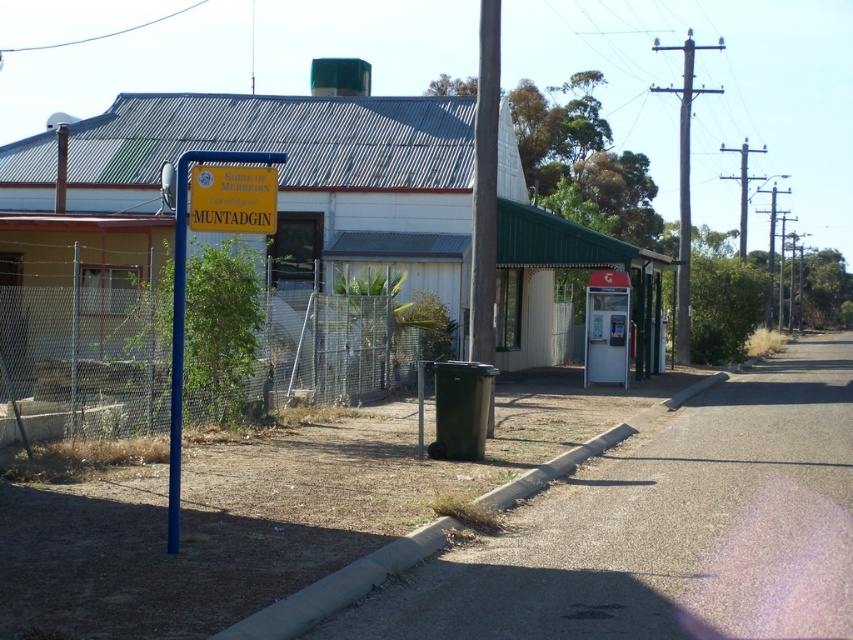
Question: Which point appears farthest from the camera in this image?

Choices:
 (A) pos(332,371)
 (B) pos(498,96)

Answer: (A)

Question: Considering the relative positions of smooth wooden pole at center and yellow plastic sign at center-left in the image provided, where is smooth wooden pole at center located with respect to yellow plastic sign at center-left?

Choices:
 (A) left
 (B) right

Answer: (B)

Question: Among these points, which one is nearest to the camera?

Choices:
 (A) (485, 333)
 (B) (178, 465)

Answer: (B)

Question: Among these points, which one is farthest from the camera?

Choices:
 (A) (685, 241)
 (B) (180, 371)

Answer: (A)

Question: Does yellow plastic sign at center-left have a larger size compared to blue metallic pole at left?

Choices:
 (A) yes
 (B) no

Answer: (A)

Question: Does yellow plastic sign at center appear on the left side of metallic pole at right?

Choices:
 (A) yes
 (B) no

Answer: (A)